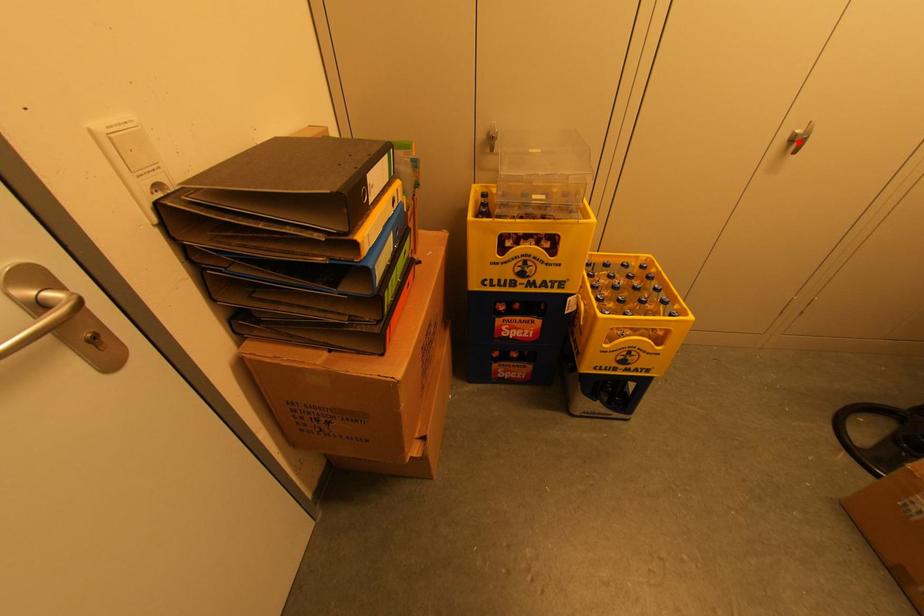
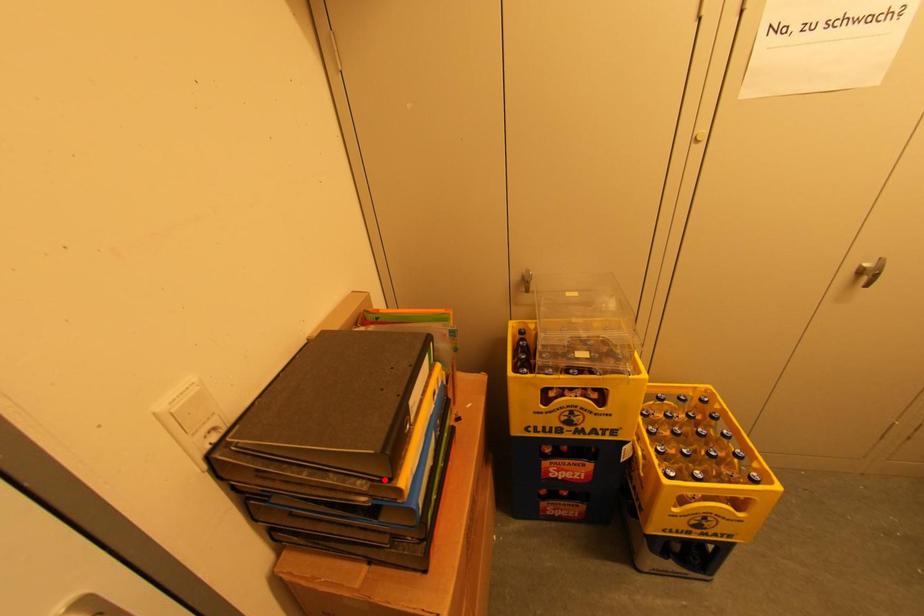
I am providing you with two images of the same scene from different viewpoints. A red point is marked on the first image and another point is marked on the second image. Are the points marked in image1 and image2 representing the same 3D position?

No